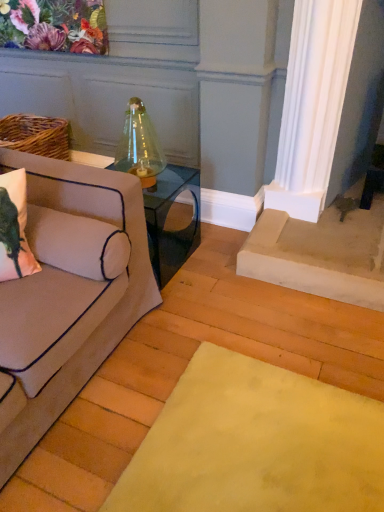
Question: Does beige fabric couch at left have a lesser height compared to matte pink pillow at left?

Choices:
 (A) yes
 (B) no

Answer: (B)

Question: Considering the relative sizes of beige fabric couch at left and matte pink pillow at left in the image provided, is beige fabric couch at left bigger than matte pink pillow at left?

Choices:
 (A) yes
 (B) no

Answer: (A)

Question: Could matte pink pillow at left be considered to be inside beige fabric couch at left?

Choices:
 (A) no
 (B) yes

Answer: (B)

Question: Considering the relative sizes of beige fabric couch at left and matte pink pillow at left in the image provided, is beige fabric couch at left wider than matte pink pillow at left?

Choices:
 (A) no
 (B) yes

Answer: (B)

Question: From a real-world perspective, is beige fabric couch at left physically above matte pink pillow at left?

Choices:
 (A) no
 (B) yes

Answer: (A)

Question: From the image's perspective, is beige fabric couch at left beneath matte pink pillow at left?

Choices:
 (A) yes
 (B) no

Answer: (A)

Question: Is matte pink pillow at left closer to camera compared to beige fabric couch at left?

Choices:
 (A) no
 (B) yes

Answer: (A)

Question: Considering the relative sizes of matte pink pillow at left and beige fabric couch at left in the image provided, is matte pink pillow at left wider than beige fabric couch at left?

Choices:
 (A) yes
 (B) no

Answer: (B)

Question: From the image's perspective, is matte pink pillow at left beneath beige fabric couch at left?

Choices:
 (A) no
 (B) yes

Answer: (A)

Question: Are matte pink pillow at left and beige fabric couch at left making contact?

Choices:
 (A) yes
 (B) no

Answer: (B)

Question: Is there a large distance between matte pink pillow at left and beige fabric couch at left?

Choices:
 (A) yes
 (B) no

Answer: (B)

Question: From the image's perspective, is matte pink pillow at left on top of beige fabric couch at left?

Choices:
 (A) yes
 (B) no

Answer: (A)

Question: Is matte pink pillow at left facing towards clear glass table at center?

Choices:
 (A) no
 (B) yes

Answer: (A)